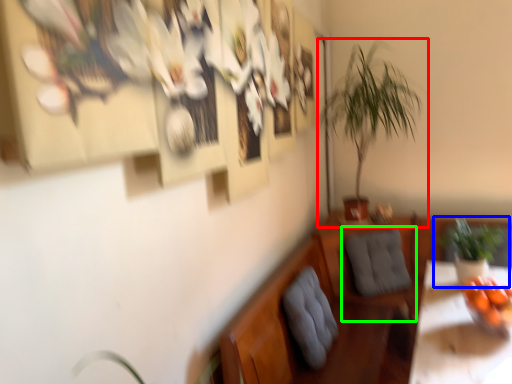
Question: Which object is the farthest from houseplant (highlighted by a red box)? Choose among these: houseplant (highlighted by a blue box) or swivel chair (highlighted by a green box).

Choices:
 (A) houseplant
 (B) swivel chair

Answer: (A)